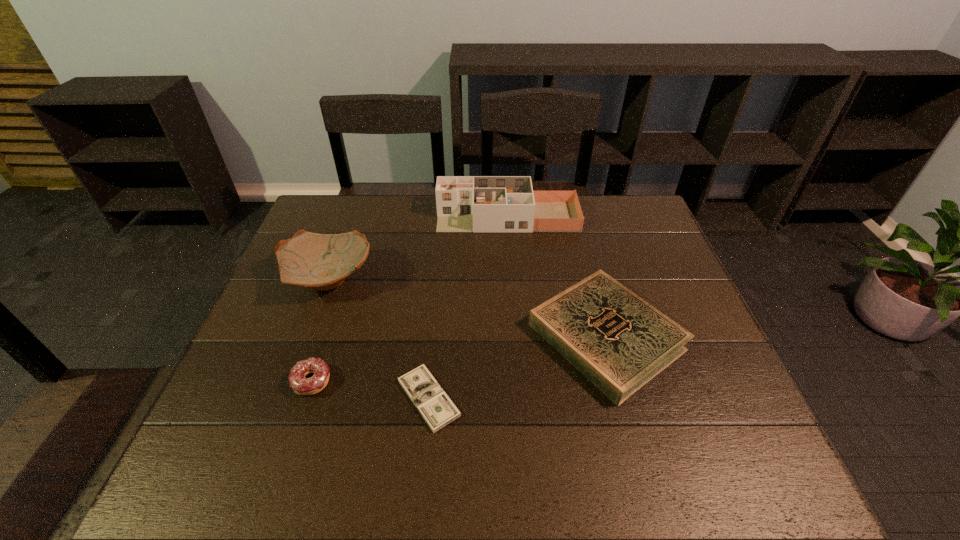
Locate an element on the screen. dollhouse is located at coordinates (464, 203).

Identify the location of pottery. This screenshot has height=540, width=960. (319, 261).

Locate an element on the screen. The height and width of the screenshot is (540, 960). the third tallest object is located at coordinates (617, 340).

Identify the location of the fourth tallest object. This screenshot has width=960, height=540. (301, 385).

The width and height of the screenshot is (960, 540). I want to click on the shortest object, so click(x=434, y=405).

This screenshot has width=960, height=540. In order to click on vacant space located 0.380m at the front door of the dollhouse in this screenshot , I will do `click(322, 217)`.

I want to click on vacant space located at the front door of the dollhouse, so [347, 217].

Find the location of a particular element. The image size is (960, 540). free space located at the front door of the dollhouse is located at coordinates (386, 217).

What are the coordinates of `vacant point located on the front of the pottery` in the screenshot? It's located at (291, 382).

Find the location of a particular element. The width and height of the screenshot is (960, 540). free space located on the front of the third tallest object is located at coordinates (638, 457).